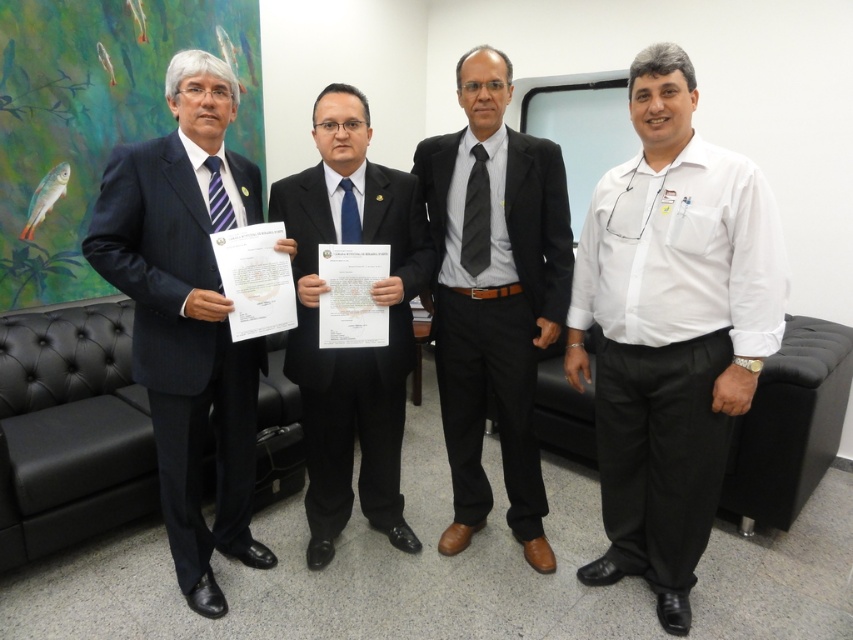
You are an event planner organizing a photo shoot in an office setting. You need to position the white cotton shirt at right and the matte black suit at left in a way that maintains their original spatial relationship. Which object should be placed lower in the frame?

The white cotton shirt at right should be placed lower in the frame because it is below the matte black suit at left in the original scene.

You are a photographer in the room and want to capture a clear photo of the black suit at center and the blue silk tie at center. Which one should you focus on to ensure it appears sharp in the photo?

You should focus on the black suit at center because it is closer to the viewer than the blue silk tie at center, so focusing on the closer object will keep it sharp while the background may blur.

You are standing in an office and see a point marked at coordinates [671,330]. Based on the scene description, what object is located at that point?

The point at coordinates [671,330] marks the white cotton shirt at right.